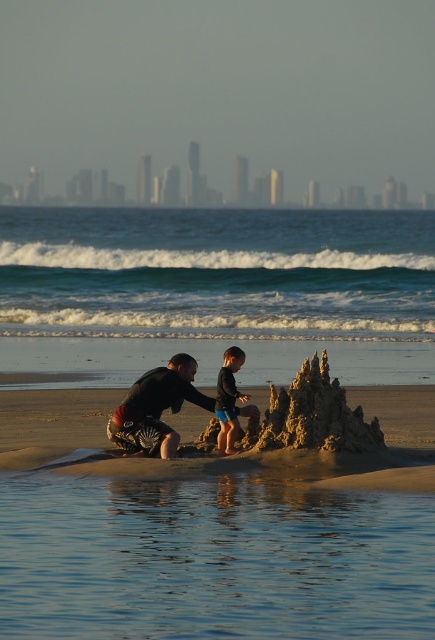
Question: Which of the following is the closest to the observer?

Choices:
 (A) (427, 403)
 (B) (240, 349)
 (C) (314, 426)
 (D) (141, 445)

Answer: (C)

Question: Is golden sandcastle at center to the left of black wetsuit at center from the viewer's perspective?

Choices:
 (A) no
 (B) yes

Answer: (A)

Question: Is brown sandy beach at center positioned at the back of black matte shorts at center?

Choices:
 (A) no
 (B) yes

Answer: (A)

Question: Considering the real-world distances, which object is farthest from the black wetsuit at center?

Choices:
 (A) teal water at upper center
 (B) golden sandcastle at center

Answer: (A)

Question: Can you confirm if teal water at upper center is bigger than black matte shorts at center?

Choices:
 (A) yes
 (B) no

Answer: (A)

Question: Which of the following is the farthest from the observer?

Choices:
 (A) black matte shorts at center
 (B) brown sandy beach at center

Answer: (A)